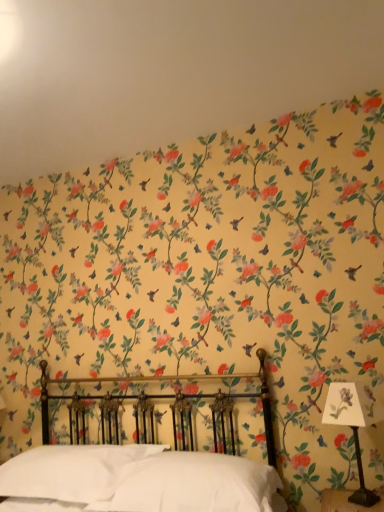
Question: Looking at their shapes, would you say white soft pillow at lower center, the first pillow from the left, is wider or thinner than polished brass bed at center?

Choices:
 (A) thin
 (B) wide

Answer: (A)

Question: Is point (79, 462) positioned closer to the camera than point (241, 395)?

Choices:
 (A) farther
 (B) closer

Answer: (B)

Question: Based on their relative distances, which object is farther from the polished brass bed at center?

Choices:
 (A) floral wallpaper at upper center
 (B) white soft pillow at lower center, which is the second pillow in right-to-left order
 (C) white paper at right
 (D) white soft pillow at center, which is the second pillow from left to right

Answer: (A)

Question: Estimate the real-world distances between objects in this image. Which object is closer to the white paper at right?

Choices:
 (A) white soft pillow at lower center, which is the second pillow in right-to-left order
 (B) white soft pillow at center, the first pillow positioned from the right
 (C) floral wallpaper at upper center
 (D) polished brass bed at center

Answer: (B)